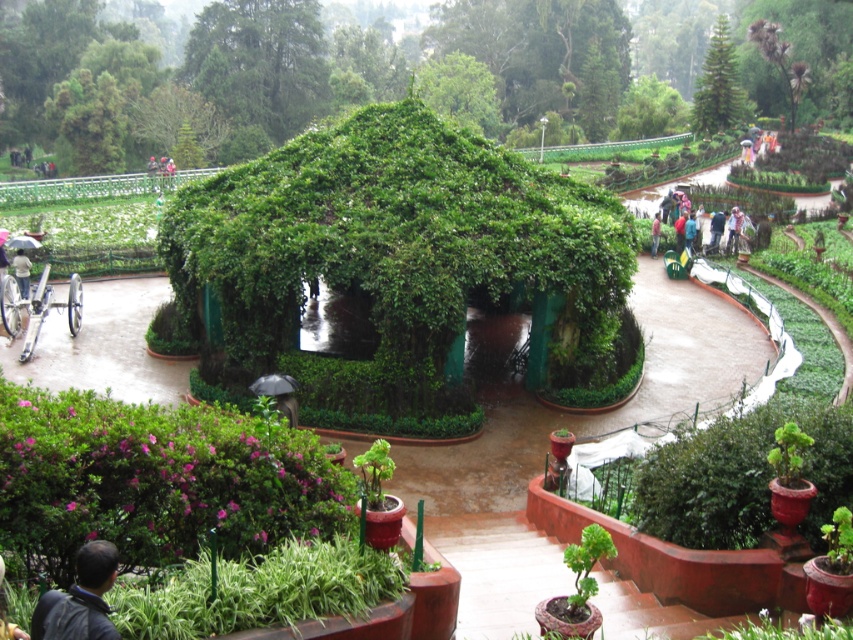
You are standing at the center of the circular structure in the garden and see the point at coordinates (80, 600). What object is located at that point?

The point at coordinates (80, 600) corresponds to the dark blue jacket at lower left.

You are a visitor in the garden and you see a person wearing a dark blue shirt at lower left and light blue jeans at center. Which clothing item is closer to the ground?

The dark blue shirt at lower left is below light blue jeans at center, so the dark blue shirt at lower left is closer to the ground.

You are standing in the garden and see the dark blue jacket at lower left and the light blue fabric umbrella at lower left. Which object is closer to you?

The dark blue jacket at lower left is closer because it is in front of the light blue fabric umbrella at lower left.